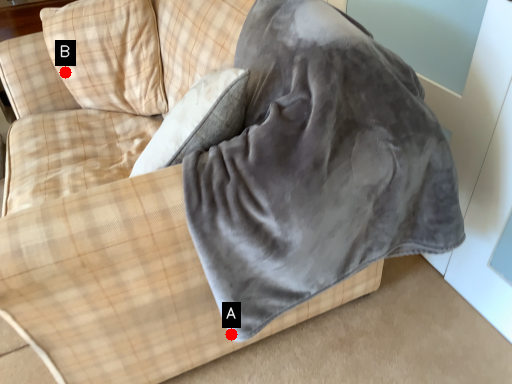
Question: Two points are circled on the image, labeled by A and B beside each circle. Which of the following is the farthest from the observer?

Choices:
 (A) A is further
 (B) B is further

Answer: (B)